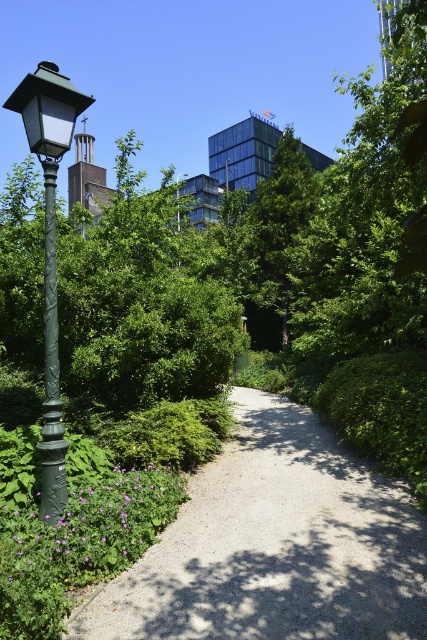
You are standing at the entrance of the park and want to locate the green matte lamp post at left. According to the coordinates provided, where exactly should you look to find it?

The green matte lamp post at left is located at point (x=49, y=252).

You are a delivery person carrying a large box that is 8 feet wide. You need to walk along the gravel path at center while avoiding the green textured pole at left. Is there enough space for you to pass safely?

The gravel path at center is 7.53 feet from the green textured pole at left. Since your box is 8 feet wide, it is wider than the available space between the path and the pole. Therefore, you cannot pass safely without risking collision.

You are a city planner reviewing the park layout. You need to determine if the green matte lamp post at left can be moved closer to the green matte street light at upper center without overlapping. Based on their sizes, is this feasible?

The green matte lamp post at left occupies less space than the green matte street light at upper center. Since the lamp post is smaller in size, it can be moved closer to the street light without overlapping as long as there is enough space between them to accommodate both objects.